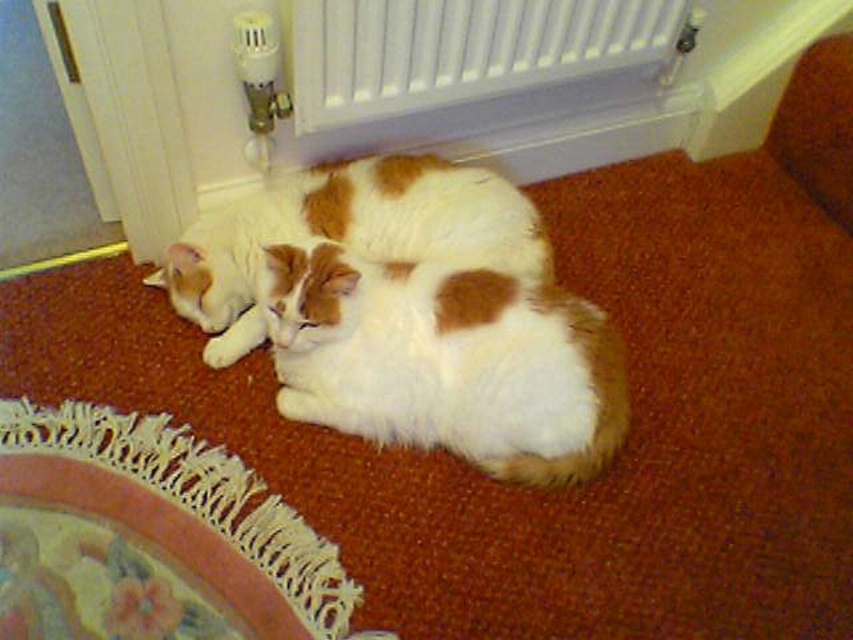
Question: Can you confirm if white plastic radiator at upper center is smaller than white soft fur cat at center?

Choices:
 (A) no
 (B) yes

Answer: (B)

Question: Which object is positioned farthest from the white fluffy cat at center?

Choices:
 (A) white soft fur cat at center
 (B) white lace mat at lower left

Answer: (B)

Question: Which point is farther from the camera taking this photo?

Choices:
 (A) (316, 74)
 (B) (280, 216)
 (C) (451, 428)
 (D) (167, 488)

Answer: (B)

Question: Does white fluffy cat at center have a larger size compared to white lace mat at lower left?

Choices:
 (A) no
 (B) yes

Answer: (B)

Question: Is white plastic radiator at upper center to the left of white lace mat at lower left from the viewer's perspective?

Choices:
 (A) yes
 (B) no

Answer: (B)

Question: Which object is closer to the camera taking this photo?

Choices:
 (A) white soft fur cat at center
 (B) white fluffy cat at center

Answer: (B)